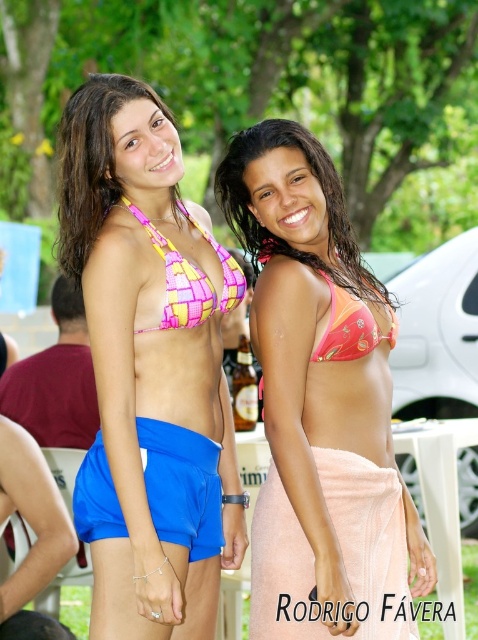
Question: From the image, what is the correct spatial relationship of pink woven bikini top at center in relation to pink checkered bikini top at upper center?

Choices:
 (A) above
 (B) below

Answer: (B)

Question: Is pink woven bikini top at center below pink fabric bikini at center?

Choices:
 (A) no
 (B) yes

Answer: (A)

Question: Which of the following is the closest to the observer?

Choices:
 (A) peach terry towel at lower right
 (B) pink matte bikini at center
 (C) pink checkered bikini top at upper center

Answer: (A)

Question: Estimate the real-world distances between objects in this image. Which object is farther from the pink matte bikini at center?

Choices:
 (A) peach terry towel at lower right
 (B) blue fabric shorts at lower left
 (C) pink woven bikini top at center

Answer: (A)

Question: Which point is farther from the camera taking this photo?

Choices:
 (A) (185, 292)
 (B) (311, 164)

Answer: (B)

Question: Does pink fabric bikini at center have a lesser width compared to blue fabric shorts at lower left?

Choices:
 (A) no
 (B) yes

Answer: (A)